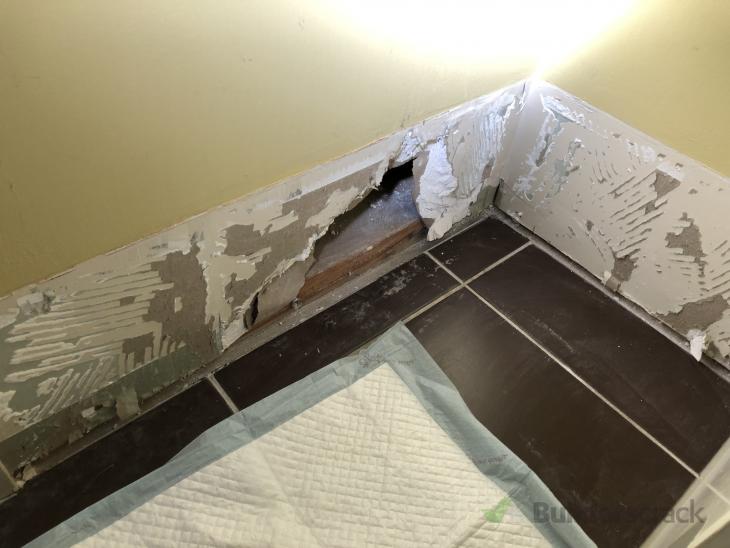
Image resolution: width=730 pixels, height=548 pixels. In order to click on poop pad in this screenshot , I will do `click(230, 518)`.